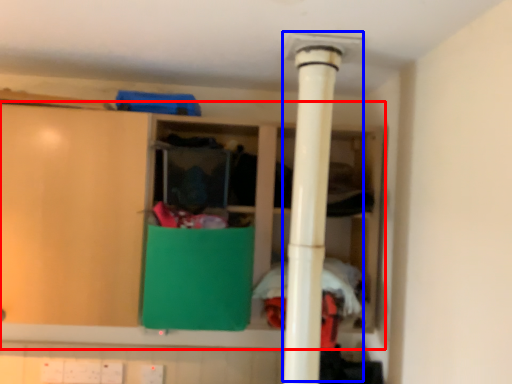
Question: Which of the following is the closest to the observer, cupboard (highlighted by a red box) or water heater (highlighted by a blue box)?

Choices:
 (A) cupboard
 (B) water heater

Answer: (B)